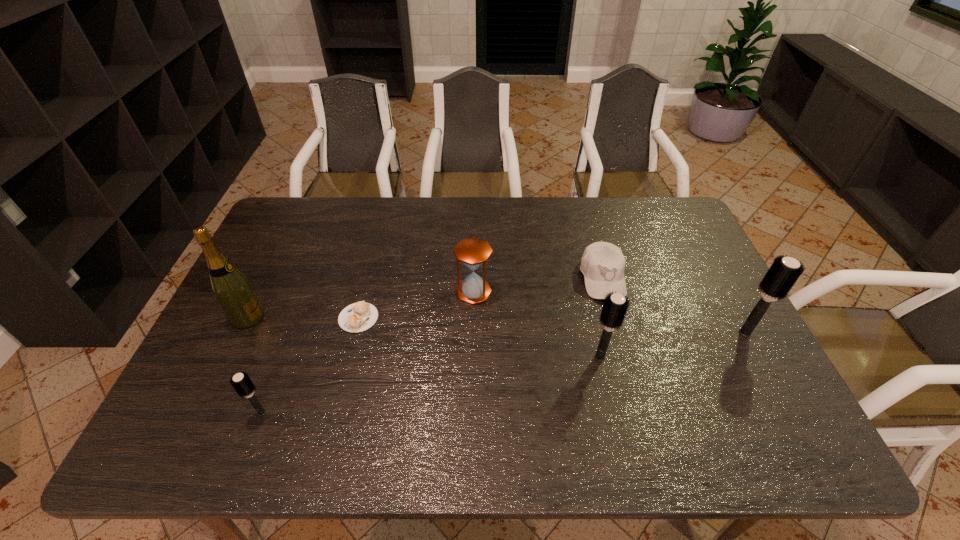
At what (x,y) coordinates should I click in order to perform the action: click on the fifth object from right to left. Please return your answer as a coordinate pair (x, y). The image size is (960, 540). Looking at the image, I should click on (357, 317).

At what (x,y) coordinates should I click in order to perform the action: click on hourglass. Please return your answer as a coordinate pair (x, y). This screenshot has height=540, width=960. Looking at the image, I should click on (473, 252).

I want to click on vacant space located 0.360m on the right of the shortest hairbrush, so click(x=424, y=413).

Where is `vacant space positioned on the right of the second nearest object`? This screenshot has height=540, width=960. vacant space positioned on the right of the second nearest object is located at coordinates (692, 357).

Where is `vacant area located on the back of the rightmost object`? This screenshot has width=960, height=540. vacant area located on the back of the rightmost object is located at coordinates (711, 270).

Identify the location of vacant space located on the front-facing side of the baseball cap. (630, 379).

Identify the location of vacant space located 0.350m on the front-facing side of the leftmost object. (389, 317).

I want to click on free space located 0.050m on the back of the shortest object, so [x=366, y=291].

Image resolution: width=960 pixels, height=540 pixels. Find the location of `vacant space situated 0.240m on the back of the hourglass`. vacant space situated 0.240m on the back of the hourglass is located at coordinates (474, 229).

Identify the location of object positioned at the near edge. This screenshot has width=960, height=540. (241, 382).